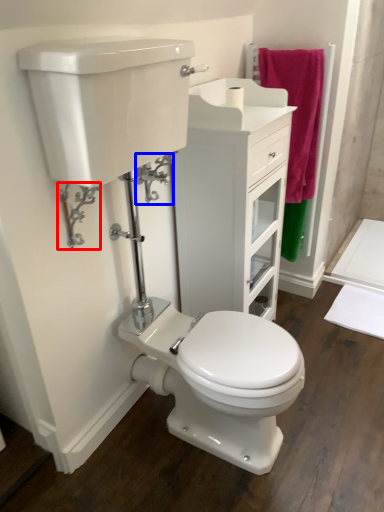
Question: Which object appears farthest to the camera in this image, plumbing fixture (highlighted by a red box) or plumbing fixture (highlighted by a blue box)?

Choices:
 (A) plumbing fixture
 (B) plumbing fixture

Answer: (B)